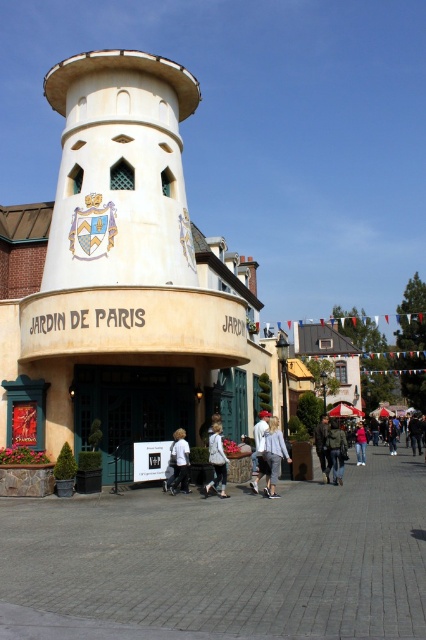
You are a photographer standing in front of the JARDIN DE PARIS building. You notice two jackets hanging on a rack near the entrance. The jackets are the white cotton jacket at center and the khaki fabric jacket at center. Which jacket would you choose to take with you if you want the smaller one?

The white cotton jacket at center has a smaller size compared to the khaki fabric jacket at center, so you should choose the white cotton jacket at center.

You are a tour guide leading a group near the JARDIN DE PARIS building. You notice two jackets left unattended on a bench in the plaza. The jackets are the white cotton jacket at center and the khaki fabric jacket at center. If you need to retrieve both jackets but can only carry one at a time, and you walk at a normal pace of 1.4 meters per second, how many seconds will it take you to collect both jackets?

The white cotton jacket at center and the khaki fabric jacket at center are 12.76 meters apart. To collect both jackets, you would need to walk from one jacket to the other and back, totaling a distance of 12.76 meters x 2. At a speed of 1.4 meters per second, the time required would be approximately 18.23 seconds.